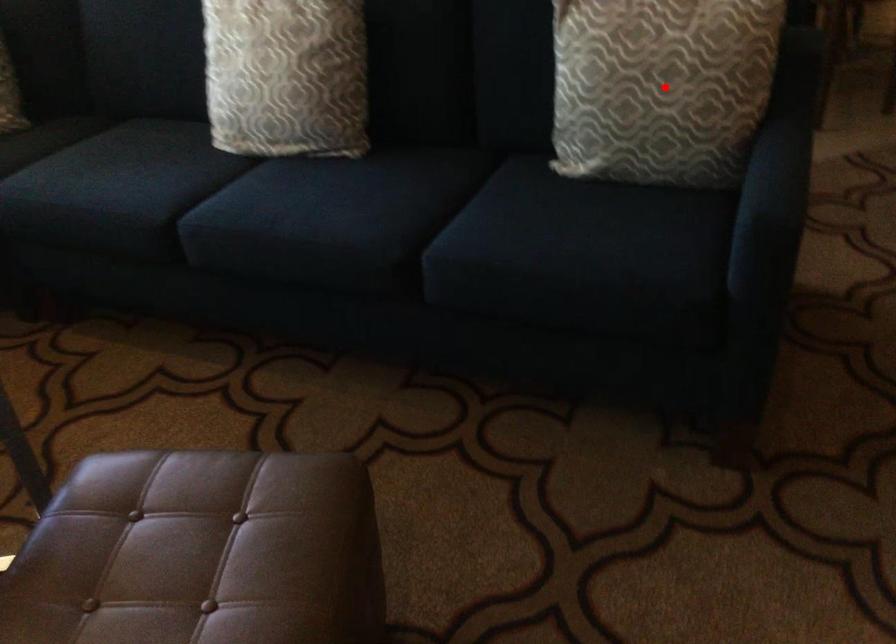
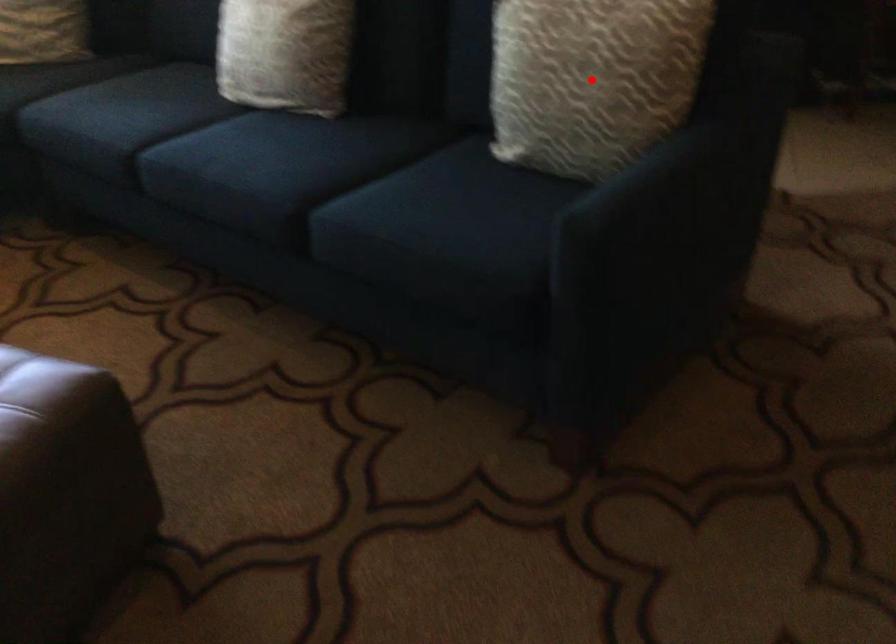
I am providing you with two images of the same scene from different viewpoints. A red point is marked on the first image and another point is marked on the second image. Does the point marked in image1 correspond to the same location as the one in image2?

Yes